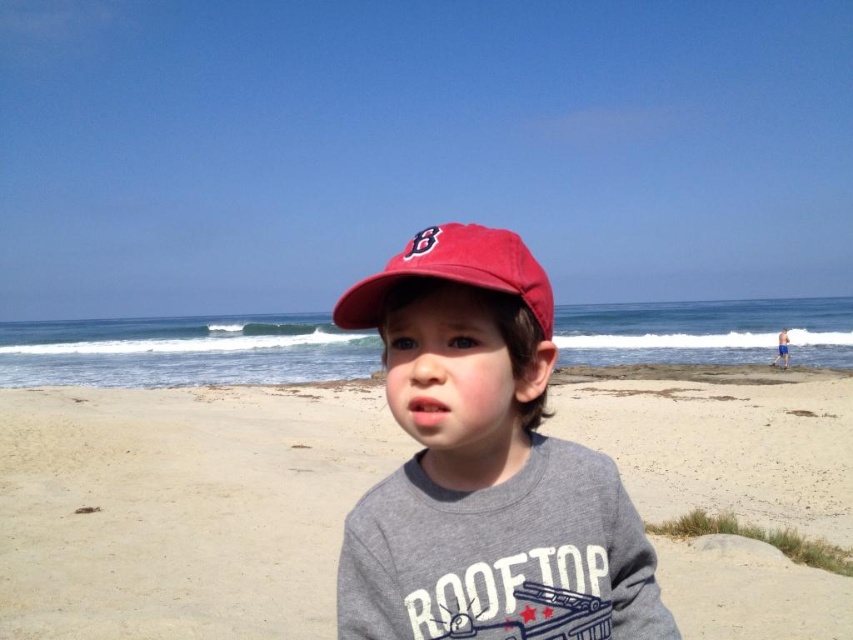
Question: Can you confirm if beige sand at center is bigger than matte red cap at center?

Choices:
 (A) yes
 (B) no

Answer: (A)

Question: Which point is farther from the camera taking this photo?

Choices:
 (A) (12, 525)
 (B) (451, 234)

Answer: (A)

Question: Which object appears closest to the camera in this image?

Choices:
 (A) matte red baseball cap at center
 (B) matte red cap at center
 (C) beige sand at center

Answer: (B)

Question: Is beige sand at center in front of matte red baseball cap at center?

Choices:
 (A) no
 (B) yes

Answer: (A)

Question: Can you confirm if beige sand at center is bigger than matte red baseball cap at center?

Choices:
 (A) no
 (B) yes

Answer: (B)

Question: Among these points, which one is farthest from the camera?

Choices:
 (A) (245, 496)
 (B) (466, 248)
 (C) (410, 396)

Answer: (A)